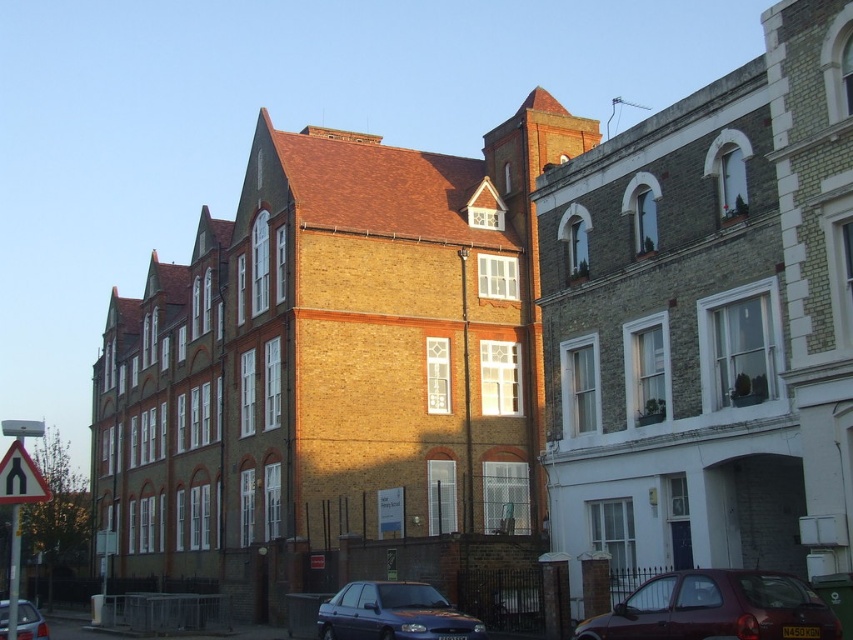
You are standing on the street and see two points marked in the image. The first point is labeled as point (346, 589) and the second is point (9, 609). Which point is closer to you?

Point (9, 609) is closer to you because it is in front of point (346, 589).

You are a pedestrian standing at the crosswalk in front of the two buildings. You see a maroon metallic hatchback at lower right and a metallic blue car at lower left. Which car is closer to the building with the reddish brown brick facade?

The metallic blue car at lower left is closer to the building with the reddish brown brick facade because the maroon metallic hatchback at lower right is to the right of the metallic blue car at lower left, placing it farther away from the left building.

You are a delivery driver who needs to park your metallic blue sedan at lower center in a parking spot located at point (393, 612). Is this parking spot available?

The parking spot at point (393, 612) is available for the metallic blue sedan at lower center as there is no vehicle occupying it.